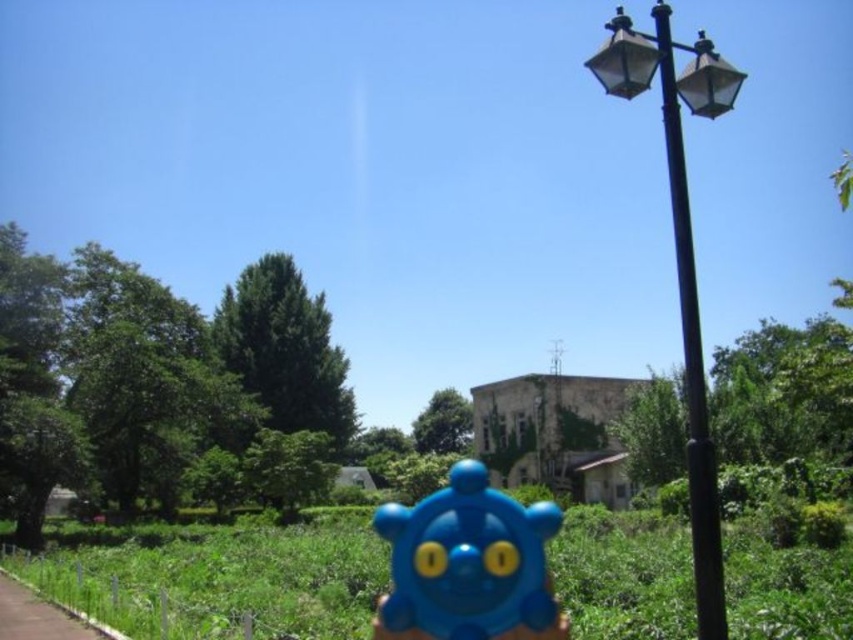
You are standing at the center of the image and want to place a blue matte toy exactly at point (467, 560). Based on the scene description, is there enough space to place the toy there without it overlapping with any objects?

The blue matte toy at center is located at point (467, 560), so yes, there is enough space to place the toy there as it is already positioned at that exact coordinate without overlapping with any objects mentioned in the scene description.

You are a city planner designing a new park layout. You need to place a bench along the brown asphalt pavement at lower left. Considering the black metal pole at right is wider than the pavement, will the bench fit on the pavement if it requires a width of 1.2 meters?

The black metal pole at right is wider than the brown asphalt pavement at lower left. Since the pavement is narrower than 1.2 meters, the bench will not fit.

You are standing at the point with coordinates point (666, 20) and want to walk towards the point with coordinates point (42, 636). Which direction should you face to walk directly towards your destination?

You should face towards the lower right direction to walk directly towards point (42, 636) from point (666, 20).